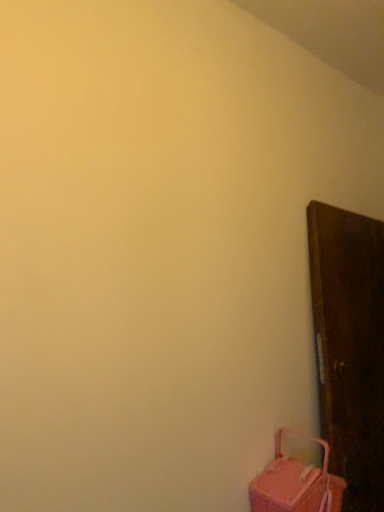
The width and height of the screenshot is (384, 512). Find the location of `pink fabric suitcase at lower right`. pink fabric suitcase at lower right is located at coordinates (296, 482).

Image resolution: width=384 pixels, height=512 pixels. Describe the element at coordinates (296, 482) in the screenshot. I see `pink fabric suitcase at lower right` at that location.

I want to click on pink fabric suitcase at lower right, so click(296, 482).